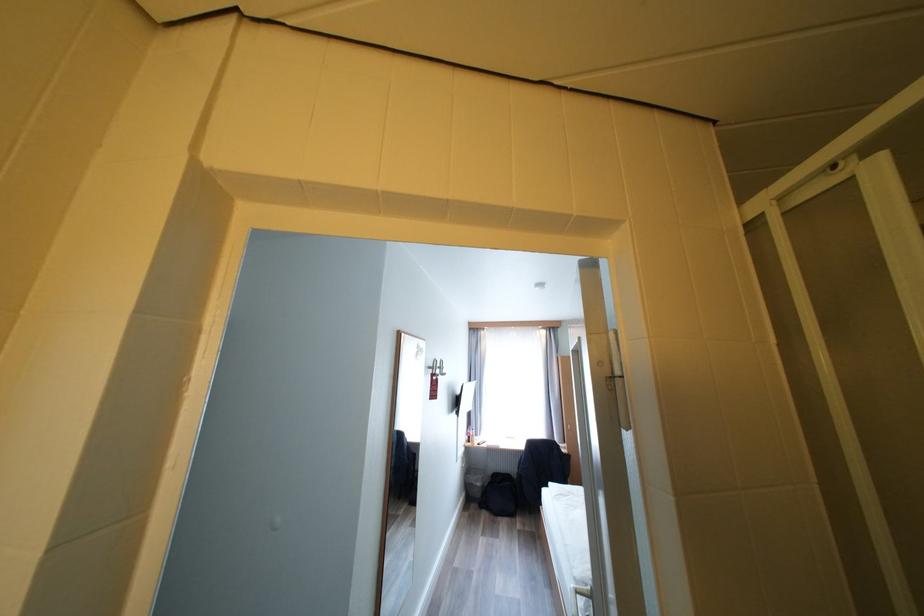
Locate an element on the screen. This screenshot has height=616, width=924. chair sitting surface is located at coordinates (540, 469).